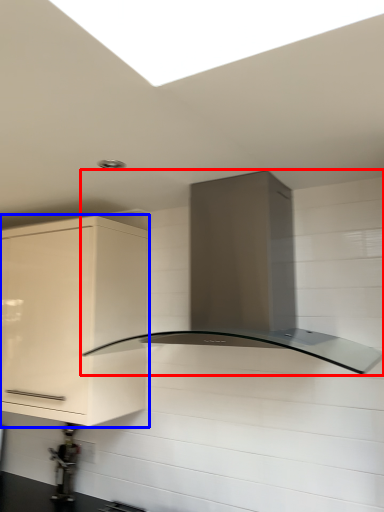
Question: Which object appears farthest to the camera in this image, home appliance (highlighted by a red box) or cabinetry (highlighted by a blue box)?

Choices:
 (A) home appliance
 (B) cabinetry

Answer: (B)